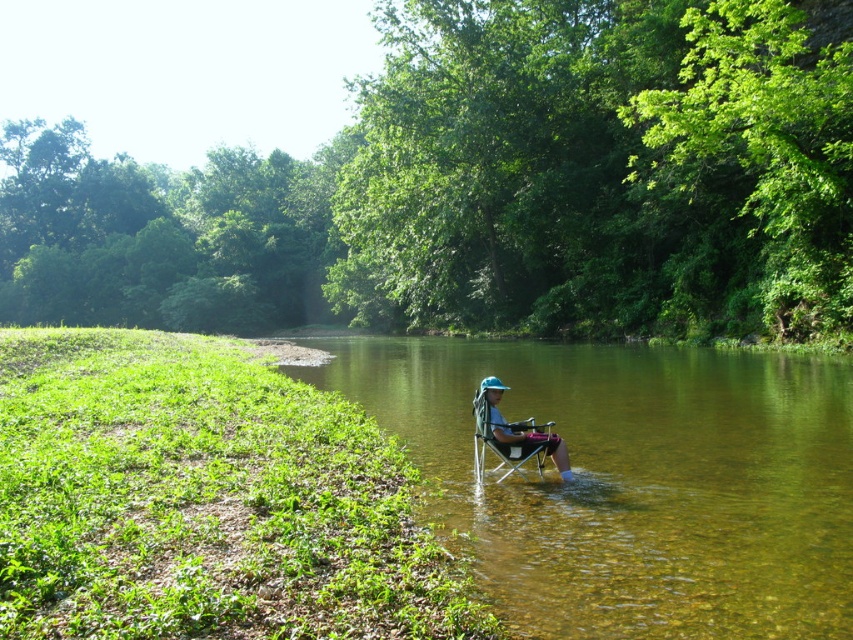
Is clear water at chair right taller than matte blue chair at center?

Yes, clear water at chair right is taller than matte blue chair at center.

Between clear water at chair right and matte blue chair at center, which one appears on the right side from the viewer's perspective?

From the viewer's perspective, clear water at chair right appears more on the right side.

Describe the element at coordinates (631, 481) in the screenshot. I see `clear water at chair right` at that location.

At what (x,y) coordinates should I click in order to perform the action: click on clear water at chair right. Please return your answer as a coordinate pair (x, y). This screenshot has height=640, width=853. Looking at the image, I should click on (631, 481).